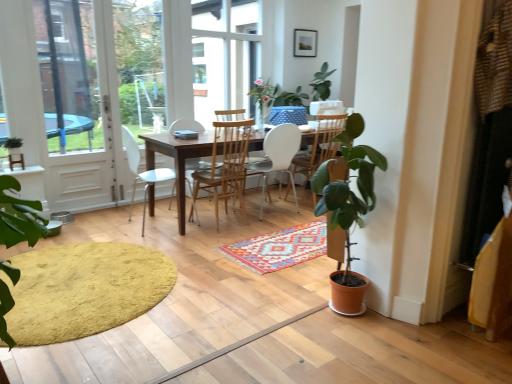
Where is `empty space that is ontop of yellow soft rug at lower left, which ranks as the first doormat in left-to-right order (from a real-world perspective)`? This screenshot has height=384, width=512. empty space that is ontop of yellow soft rug at lower left, which ranks as the first doormat in left-to-right order (from a real-world perspective) is located at coordinates (91, 285).